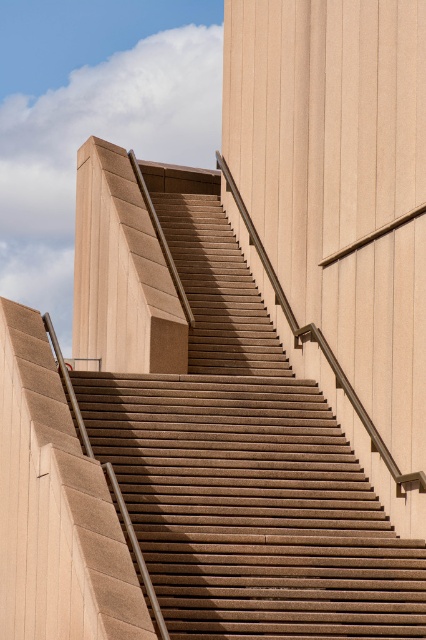
You are standing at the bottom of the brown textured stairs at center and want to reach the top of the sandy beige concrete pillar at upper left. Which object will you need to climb first?

You will need to climb the brown textured stairs at center first because it is taller than the sandy beige concrete pillar at upper left, so the stairs must be climbed to reach the pillar.

You are standing at the base of the stairs and want to reach the point at coordinates (186, 561). Given that the stairs are 100 feet long, will you have to walk the entire length of the stairs to reach that point?

The point at coordinates (186, 561) is 84.47 feet from the camera, so you will not have to walk the entire length of the stairs to reach it since it is within the 100 feet length of the stairs.